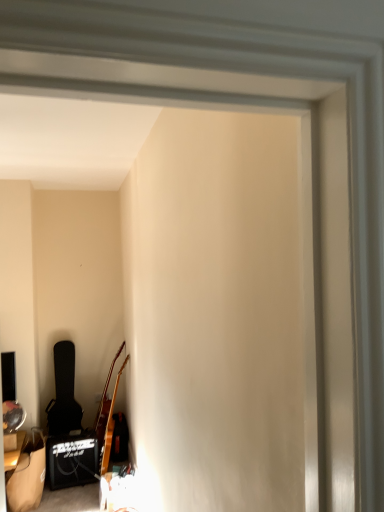
Question: Should I look upward or downward to see black textured guitar case at left?

Choices:
 (A) down
 (B) up

Answer: (A)

Question: Is wooden acoustic guitar at lower left positioned far away from black textured guitar case at left?

Choices:
 (A) no
 (B) yes

Answer: (A)

Question: Is wooden acoustic guitar at lower left to the left of black textured guitar case at left from the viewer's perspective?

Choices:
 (A) no
 (B) yes

Answer: (A)

Question: Is wooden acoustic guitar at lower left further to the viewer compared to black textured guitar case at left?

Choices:
 (A) yes
 (B) no

Answer: (B)

Question: From the image's perspective, is wooden acoustic guitar at lower left located beneath black textured guitar case at left?

Choices:
 (A) no
 (B) yes

Answer: (B)

Question: Can you confirm if wooden acoustic guitar at lower left is taller than black textured guitar case at left?

Choices:
 (A) no
 (B) yes

Answer: (B)

Question: Can you confirm if wooden acoustic guitar at lower left is wider than black textured guitar case at left?

Choices:
 (A) yes
 (B) no

Answer: (B)

Question: From the image's perspective, would you say black textured guitar case at left is positioned over wooden acoustic guitar at lower left?

Choices:
 (A) no
 (B) yes

Answer: (B)

Question: Considering the relative sizes of black textured guitar case at left and wooden acoustic guitar at lower left in the image provided, is black textured guitar case at left smaller than wooden acoustic guitar at lower left?

Choices:
 (A) yes
 (B) no

Answer: (B)

Question: From the image's perspective, is black textured guitar case at left beneath wooden acoustic guitar at lower left?

Choices:
 (A) yes
 (B) no

Answer: (B)

Question: Is black textured guitar case at left facing away from wooden acoustic guitar at lower left?

Choices:
 (A) yes
 (B) no

Answer: (B)

Question: Does black textured guitar case at left have a lesser height compared to wooden acoustic guitar at lower left?

Choices:
 (A) yes
 (B) no

Answer: (A)

Question: Considering the relative sizes of black textured guitar case at left and wooden acoustic guitar at lower left in the image provided, is black textured guitar case at left taller than wooden acoustic guitar at lower left?

Choices:
 (A) yes
 (B) no

Answer: (B)

Question: Considering the positions of point (107, 457) and point (72, 409), is point (107, 457) closer or farther from the camera than point (72, 409)?

Choices:
 (A) farther
 (B) closer

Answer: (B)